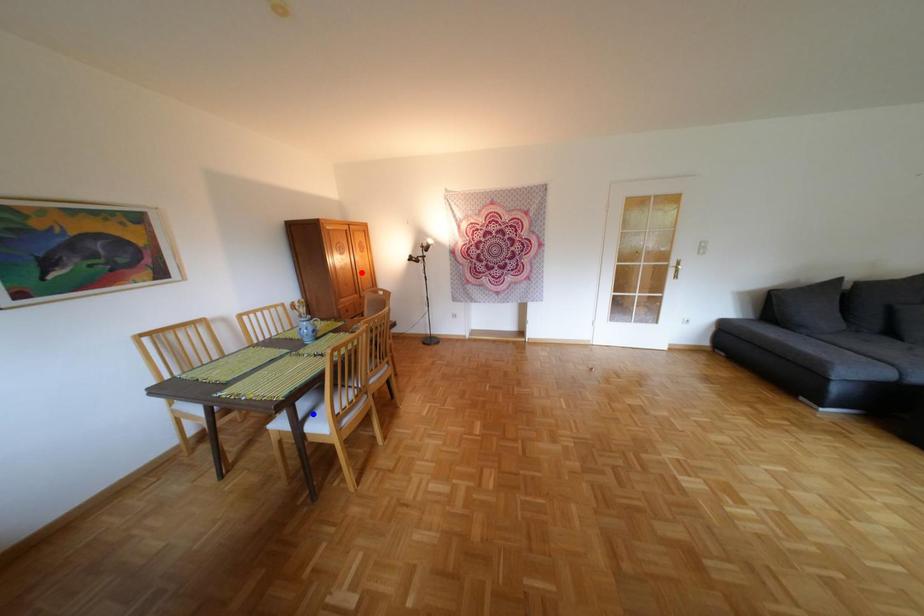
Question: Which of the two points in the image is closer to the camera?

Choices:
 (A) Blue point is closer.
 (B) Red point is closer.

Answer: (A)